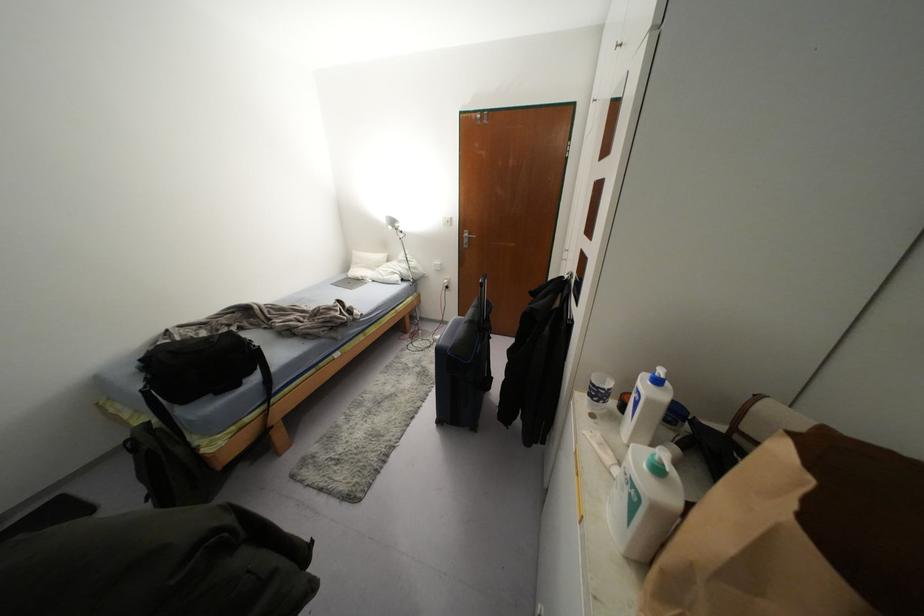
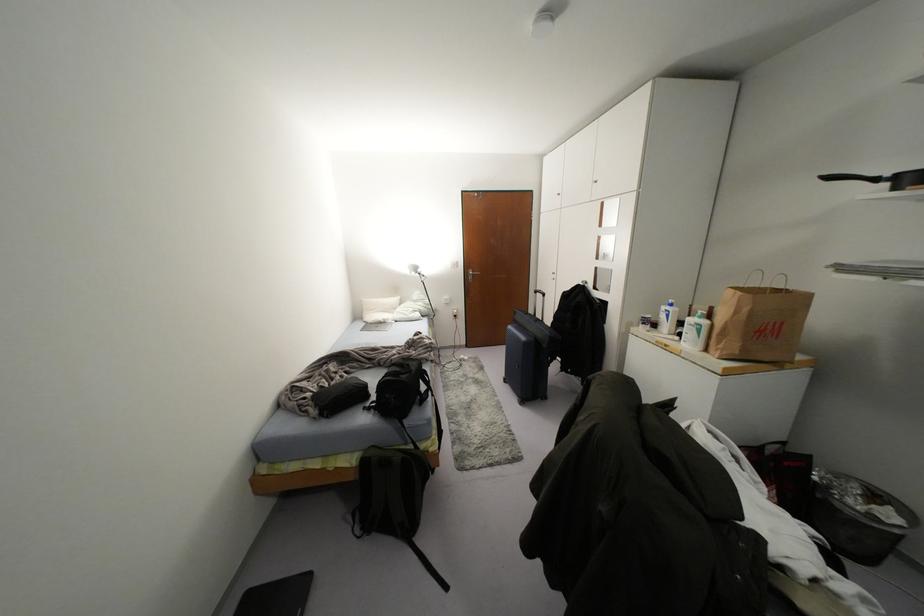
Locate, in the second image, the point that corresponds to (x=448, y=222) in the first image.

(456, 264)